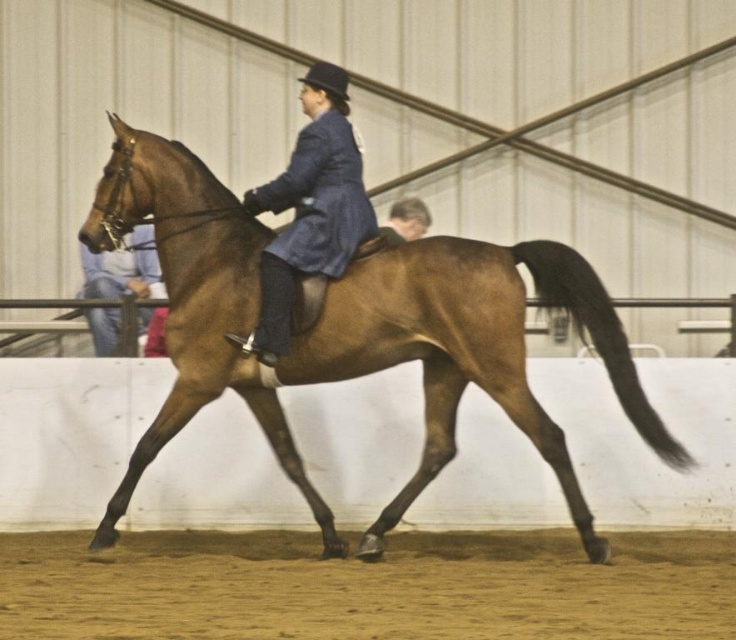
Between brown glossy horse at center and blue woolen coat at center, which one is positioned higher?

blue woolen coat at center is higher up.

Between brown glossy horse at center and blue woolen coat at center, which one has less height?

blue woolen coat at center is shorter.

Image resolution: width=736 pixels, height=640 pixels. Describe the element at coordinates (470, 349) in the screenshot. I see `brown glossy horse at center` at that location.

Identify the location of brown glossy horse at center. The width and height of the screenshot is (736, 640). (470, 349).